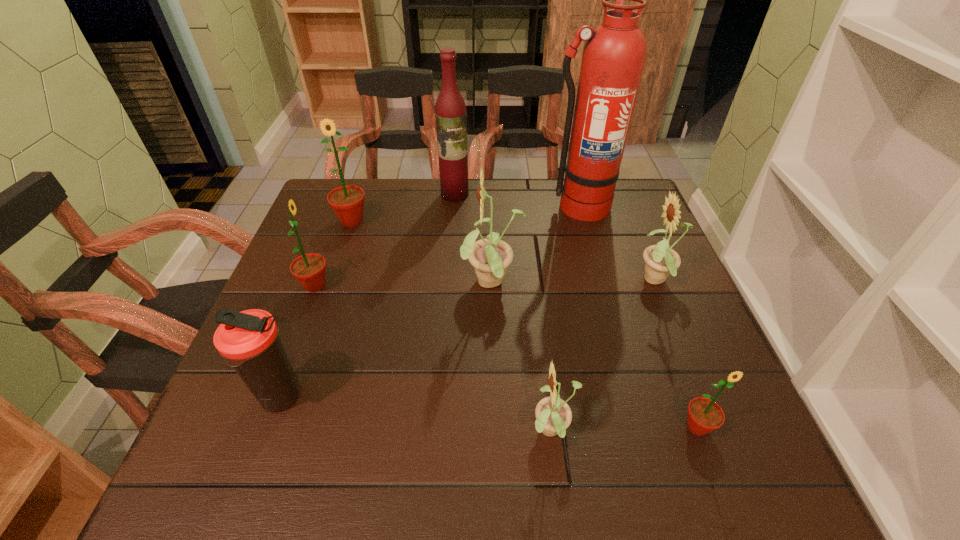
Find the location of a particular element. This screenshot has width=960, height=540. the rightmost green sunflower is located at coordinates (704, 415).

I want to click on the smallest green sunflower, so click(704, 415).

Where is `vacant region located 0.390m on the label side of the fire extinguisher`? The image size is (960, 540). vacant region located 0.390m on the label side of the fire extinguisher is located at coordinates (612, 332).

You are a GUI agent. You are given a task and a screenshot of the screen. Output one action in this format:
    pyautogui.click(x=<x>, y=<y>)
    Task: Click on the blank space located 0.190m on the label of the second tallest object
    The width and height of the screenshot is (960, 540).
    Given the screenshot: What is the action you would take?
    pyautogui.click(x=451, y=244)

Where is `free spot located 0.060m on the front-facing side of the biggest yellow sunflower`? This screenshot has width=960, height=540. free spot located 0.060m on the front-facing side of the biggest yellow sunflower is located at coordinates (437, 284).

Locate an element on the screen. The height and width of the screenshot is (540, 960). vacant position located 0.250m on the front-facing side of the biggest yellow sunflower is located at coordinates (356, 284).

At what (x,y) coordinates should I click in order to perform the action: click on free space located on the front-facing side of the biggest yellow sunflower. Please return your answer as a coordinate pair (x, y). The height and width of the screenshot is (540, 960). Looking at the image, I should click on (407, 284).

Find the location of a particular element. vacant space located on the face of the farthest sunflower is located at coordinates (339, 259).

The width and height of the screenshot is (960, 540). Identify the location of free space located 0.210m on the front-facing side of the rightmost yellow sunflower. click(545, 281).

This screenshot has width=960, height=540. I want to click on vacant area situated 0.400m on the front-facing side of the rightmost yellow sunflower, so tap(465, 281).